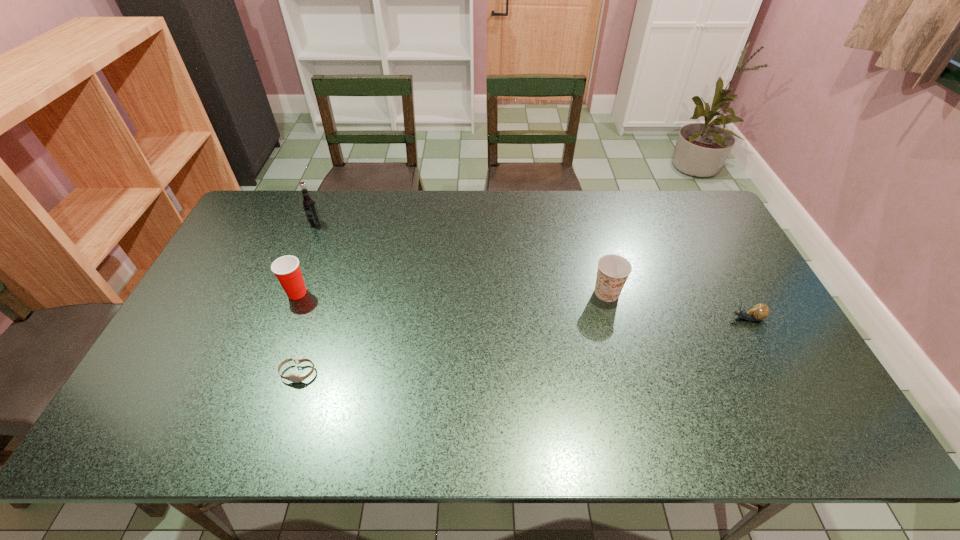
The image size is (960, 540). I want to click on vacant region located 0.090m on the front of the right Dixie cup, so click(x=617, y=330).

At what (x,y) coordinates should I click in order to perform the action: click on free space located on the front-facing side of the rightmost object. Please return your answer as a coordinate pair (x, y). Looking at the image, I should click on (692, 318).

The width and height of the screenshot is (960, 540). I want to click on vacant space located 0.070m on the front-facing side of the rightmost object, so click(704, 318).

What are the coordinates of `vacant space located 0.350m on the front-facing side of the rightmost object` in the screenshot? It's located at [x=602, y=318].

Find the location of a particular element. free space located 0.050m on the face of the nearest object is located at coordinates (288, 402).

The width and height of the screenshot is (960, 540). What are the coordinates of `object that is positioned at the far edge` in the screenshot? It's located at (308, 203).

This screenshot has width=960, height=540. Find the location of `object situated at the right edge`. object situated at the right edge is located at coordinates (760, 311).

This screenshot has width=960, height=540. In the image, there is a desktop. Identify the location of vacant space at the far edge. (523, 202).

Where is `free region at the near edge`? The height and width of the screenshot is (540, 960). free region at the near edge is located at coordinates (769, 446).

Where is `free location at the far left corner of the desktop`? This screenshot has width=960, height=540. free location at the far left corner of the desktop is located at coordinates (262, 215).